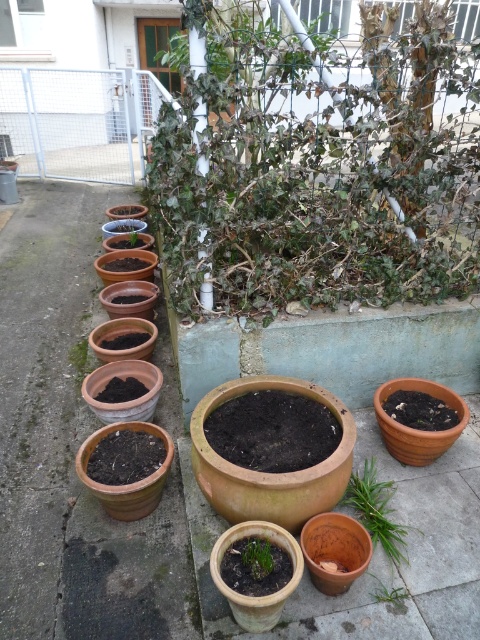
Based on the photo, you are a gardener who wants to place a new decorative stone on the concrete pathway between the terracotta clay pots at center and the green leafy plant at lower right. Based on the scene, where should you position the stone so it doesn

The terracotta clay pots at center are above the green leafy plant at lower right, so you should place the stone between them on the concrete pathway below the pots and above the plant.

You are a gardener planning to plant a new flower in the green leafy plant at center. Based on its current position, what are the coordinates where you should place the new flower?

The green leafy plant at center is located at coordinates point (320, 163), so you should place the new flower at that position.